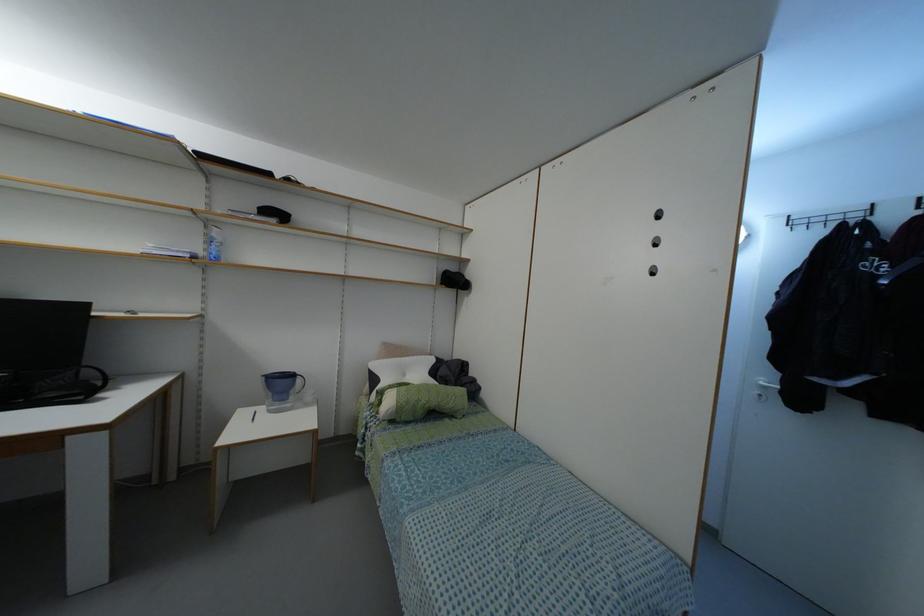
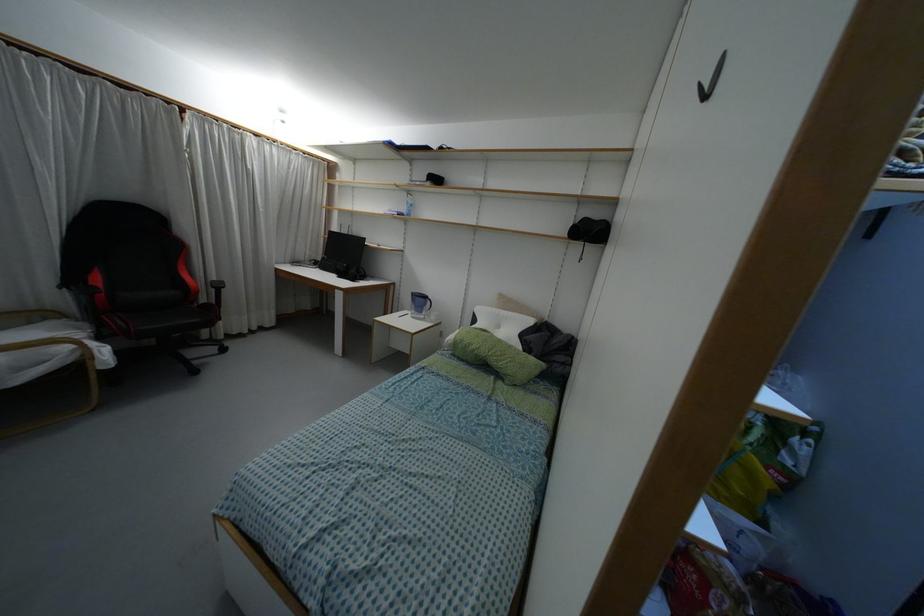
The point at (298,379) is marked in the first image. Where is the corresponding point in the second image?

(428, 302)